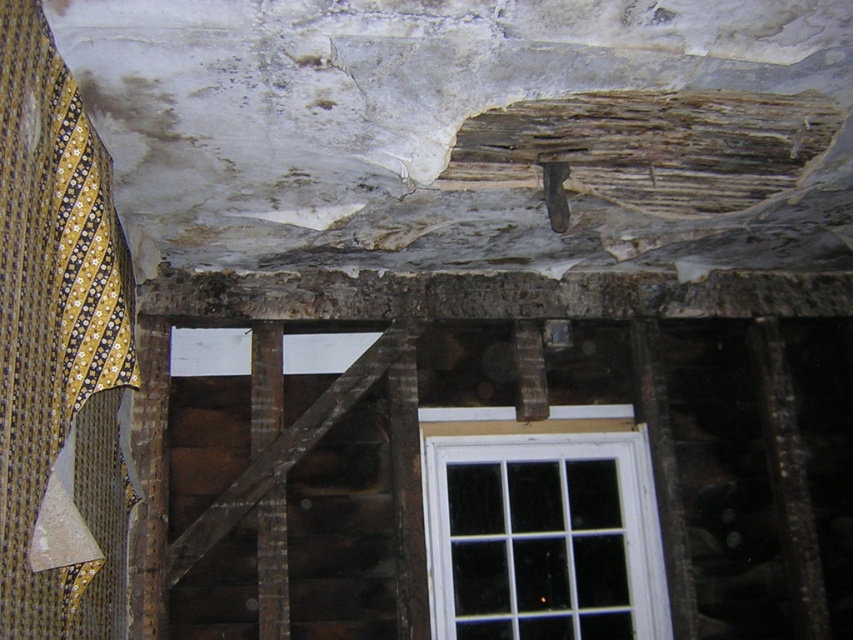
Question: Can you confirm if yellow striped fabric at left is bigger than white plastic window at lower center?

Choices:
 (A) yes
 (B) no

Answer: (A)

Question: Can you confirm if yellow striped fabric at left is bigger than white plastic window at lower center?

Choices:
 (A) yes
 (B) no

Answer: (A)

Question: Which object is closer to the camera taking this photo?

Choices:
 (A) white plastic window at lower center
 (B) yellow striped fabric at left

Answer: (B)

Question: Does yellow striped fabric at left have a smaller size compared to white plastic window at lower center?

Choices:
 (A) yes
 (B) no

Answer: (B)

Question: Which of the following is the farthest from the observer?

Choices:
 (A) (61, 284)
 (B) (602, 483)

Answer: (B)